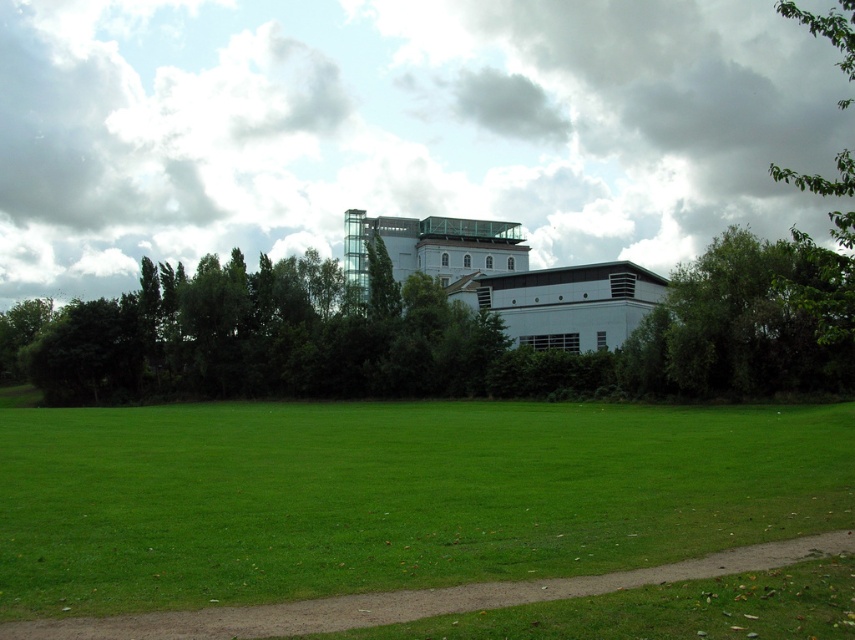
Question: Is green grass at lower center to the left of brown dirt path at lower center from the viewer's perspective?

Choices:
 (A) no
 (B) yes

Answer: (B)

Question: Based on their relative distances, which object is nearer to the green grass at lower center?

Choices:
 (A) brown dirt path at lower center
 (B) green leafy tree at upper right

Answer: (A)

Question: Which point appears closest to the camera in this image?

Choices:
 (A) (694, 451)
 (B) (783, 10)

Answer: (A)

Question: Is green grass at lower center wider than green leafy tree at upper right?

Choices:
 (A) yes
 (B) no

Answer: (B)

Question: Does green grass at lower center lie behind green leafy tree at upper right?

Choices:
 (A) yes
 (B) no

Answer: (B)

Question: Estimate the real-world distances between objects in this image. Which object is closer to the brown dirt path at lower center?

Choices:
 (A) green leafy tree at upper right
 (B) green grass at lower center

Answer: (B)